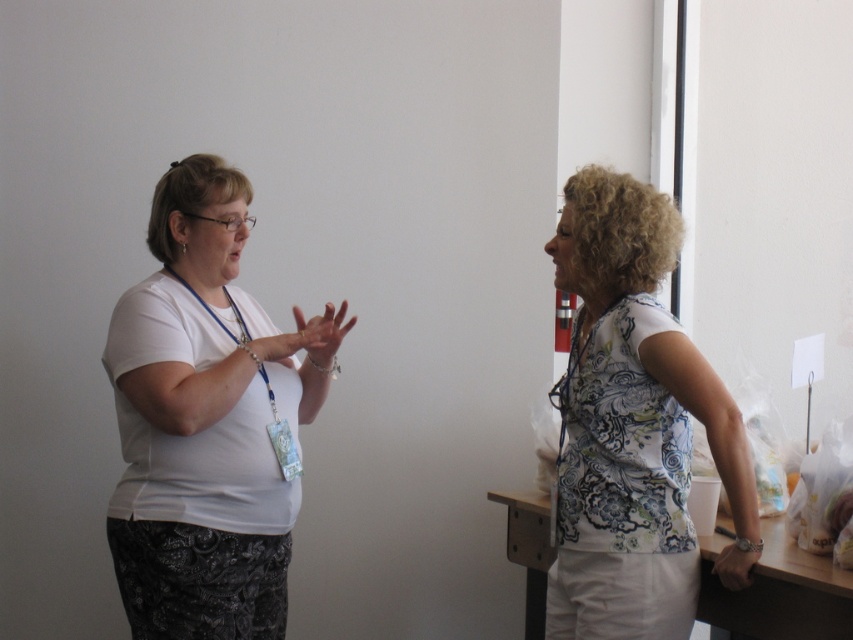
You are a tailor measuring clothes for customers. You have two garments in front of you, the white matte shirt at center and the white printed blouse at right. Which garment has a taller height?

The white matte shirt at center has a greater height compared to the white printed blouse at right.

You are organizing a charity event and need to decide which of the two white tops to donate. The white matte shirt at center and the white printed blouse at right are both available. Based on their sizes, which one would be more suitable for someone needing a larger clothing size?

The white matte shirt at center is larger in size than the white printed blouse at right, so it would be more suitable for someone needing a larger clothing size.

You are standing in the room and want to hand a document to both the white matte shirt at center and the white printed blouse at right. Which person should you approach first to reach them more quickly?

You should approach the white matte shirt at center first because it is closer to you than the white printed blouse at right, so you can reach them more quickly.